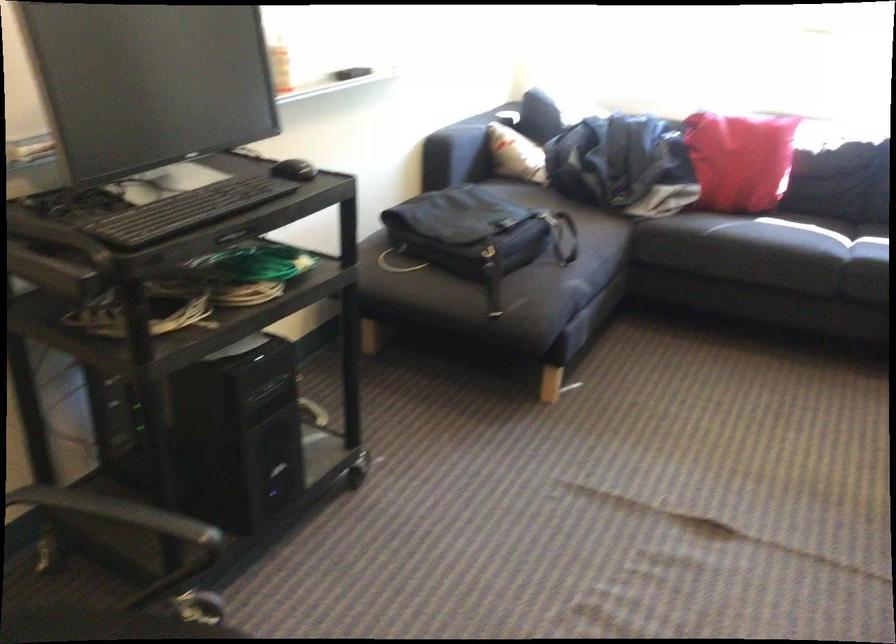
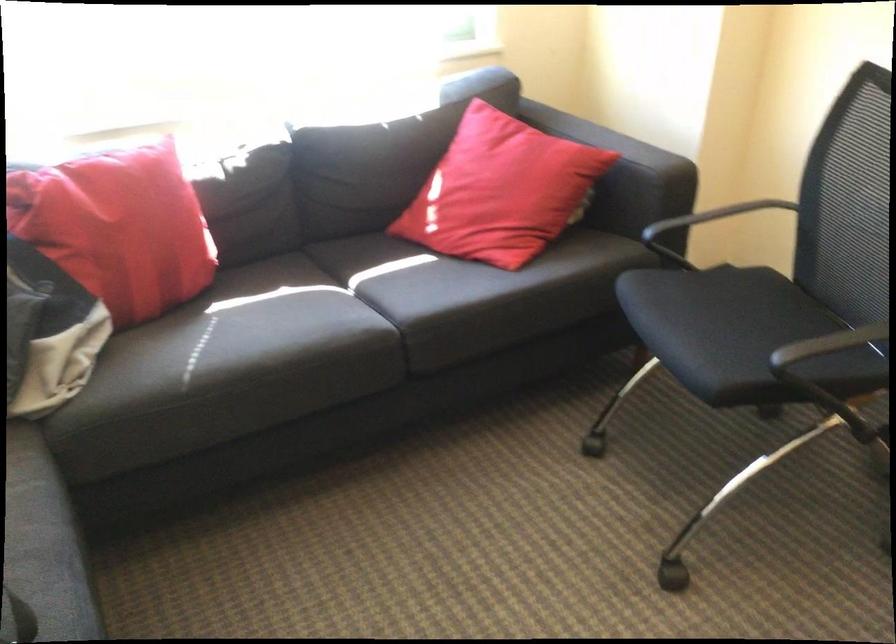
The point at (771, 236) is marked in the first image. Where is the corresponding point in the second image?

(280, 346)